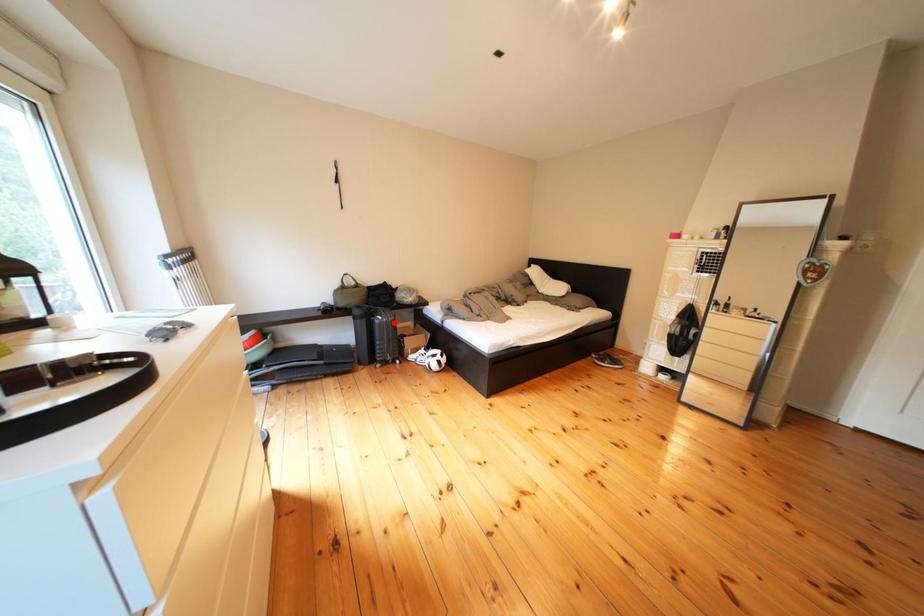
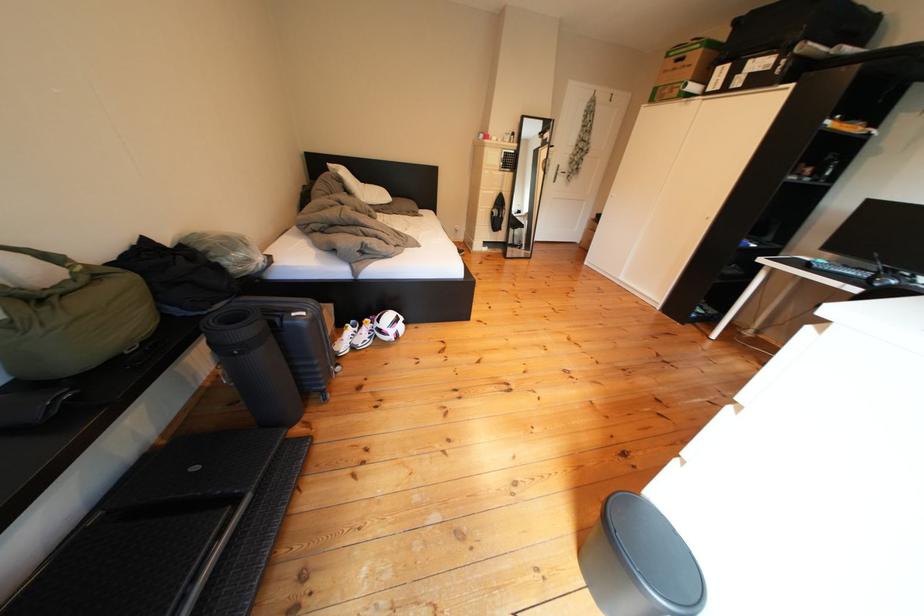
Question: I am providing you with two images of the same scene from different viewpoints. Image1 has a red point marked. In image2, the corresponding 3D location appears at what relative position? Reply with the corresponding letter.

Choices:
 (A) Closer
 (B) Farther

Answer: (A)